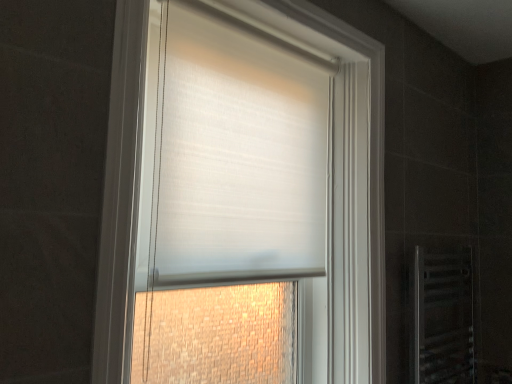
Question: Is white sheer blind at center positioned beyond the bounds of clear plastic screen door at lower right?

Choices:
 (A) no
 (B) yes

Answer: (B)

Question: Are white sheer blind at center and clear plastic screen door at lower right making contact?

Choices:
 (A) yes
 (B) no

Answer: (B)

Question: Can you confirm if white sheer blind at center is shorter than clear plastic screen door at lower right?

Choices:
 (A) yes
 (B) no

Answer: (B)

Question: Can you confirm if white sheer blind at center is positioned to the right of clear plastic screen door at lower right?

Choices:
 (A) yes
 (B) no

Answer: (B)

Question: From the image's perspective, is white sheer blind at center above clear plastic screen door at lower right?

Choices:
 (A) no
 (B) yes

Answer: (B)

Question: Is white sheer blind at center facing away from clear plastic screen door at lower right?

Choices:
 (A) yes
 (B) no

Answer: (B)

Question: Considering the relative sizes of white matte roller blind at center and white sheer blind at center in the image provided, is white matte roller blind at center shorter than white sheer blind at center?

Choices:
 (A) yes
 (B) no

Answer: (B)

Question: Is white matte roller blind at center at the left side of white sheer blind at center?

Choices:
 (A) no
 (B) yes

Answer: (A)

Question: From a real-world perspective, is white matte roller blind at center physically above white sheer blind at center?

Choices:
 (A) yes
 (B) no

Answer: (B)

Question: From the image's perspective, is white matte roller blind at center located above white sheer blind at center?

Choices:
 (A) no
 (B) yes

Answer: (A)

Question: Does white matte roller blind at center lie in front of white sheer blind at center?

Choices:
 (A) yes
 (B) no

Answer: (A)

Question: Is white sheer blind at center completely or partially inside white matte roller blind at center?

Choices:
 (A) yes
 (B) no

Answer: (A)

Question: Can you confirm if clear plastic screen door at lower right is shorter than white matte roller blind at center?

Choices:
 (A) yes
 (B) no

Answer: (A)